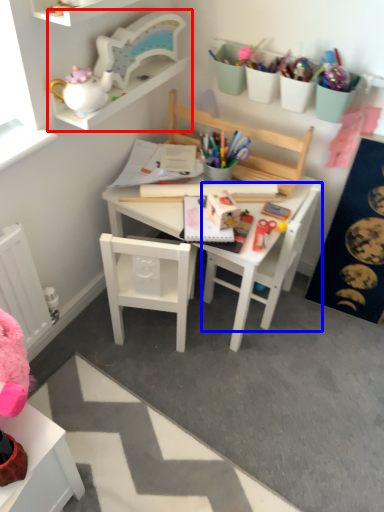
Question: Which object appears farthest to the camera in this image, shelf (highlighted by a red box) or chair (highlighted by a blue box)?

Choices:
 (A) shelf
 (B) chair

Answer: (B)